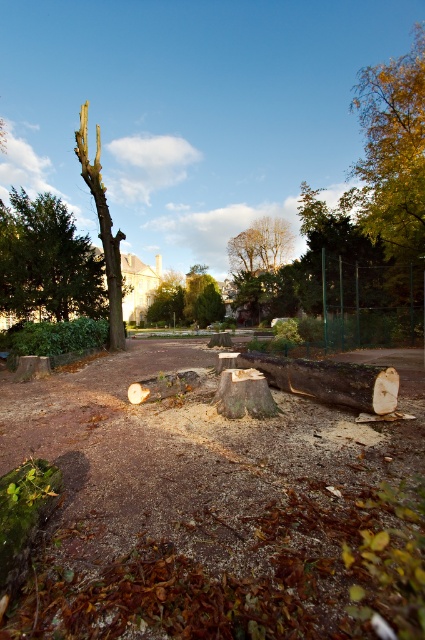
You are a gardener in the park and you need to move the brown rough wood log at center and the green leafy tree at center to different locations. Which object is closer to the right side of the image?

The brown rough wood log at center is closer to the right side of the image than the green leafy tree at center because the brown rough wood log at center is to the right of green leafy tree at center.

You are standing in the park and see the green matte tree at upper left and the green leafy tree at center. Which tree would appear larger in your field of view?

The green matte tree at upper left would appear larger in your field of view because it is closer to you than the green leafy tree at center.

You are a park visitor trying to find the best spot to take a photo of both the green matte tree at upper left and the green leafy tree at center. Based on their positions, which tree should you position closer to the front of your camera frame to include both in the shot?

To include both the green matte tree at upper left and the green leafy tree at center in the photo, you should position the green matte tree at upper left closer to the front of your camera frame since it is below the green leafy tree at center.